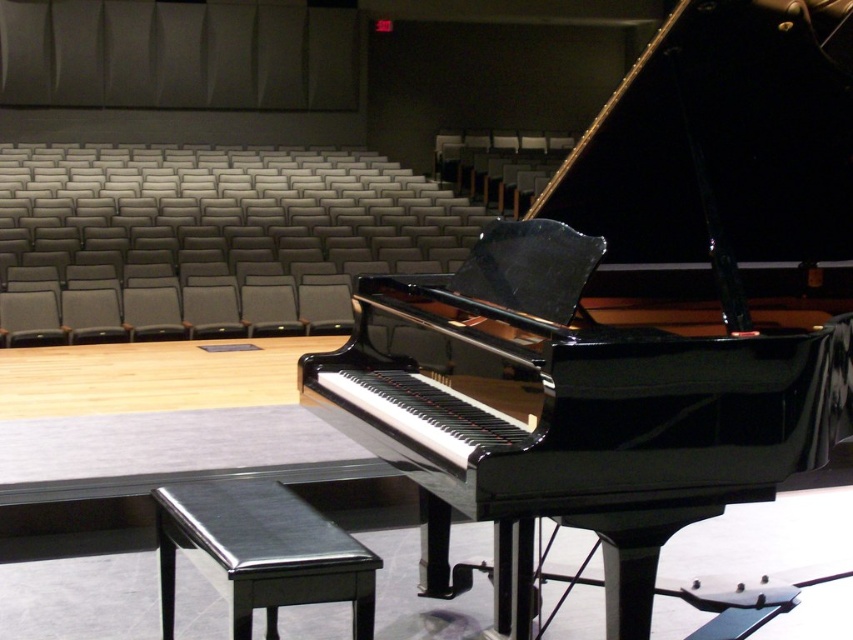
Question: Considering the relative positions of glossy black piano at center and shiny black stool at lower center in the image provided, where is glossy black piano at center located with respect to shiny black stool at lower center?

Choices:
 (A) below
 (B) above

Answer: (B)

Question: Which point is farther to the camera?

Choices:
 (A) glossy black piano at center
 (B) shiny black stool at lower center

Answer: (B)

Question: Which point is closer to the camera?

Choices:
 (A) shiny black stool at lower center
 (B) glossy black piano at center

Answer: (B)

Question: Among these points, which one is farthest from the camera?

Choices:
 (A) (578, 250)
 (B) (234, 573)

Answer: (A)

Question: In this image, where is glossy black piano at center located relative to shiny black stool at lower center?

Choices:
 (A) below
 (B) above

Answer: (B)

Question: Does glossy black piano at center appear over shiny black stool at lower center?

Choices:
 (A) yes
 (B) no

Answer: (A)